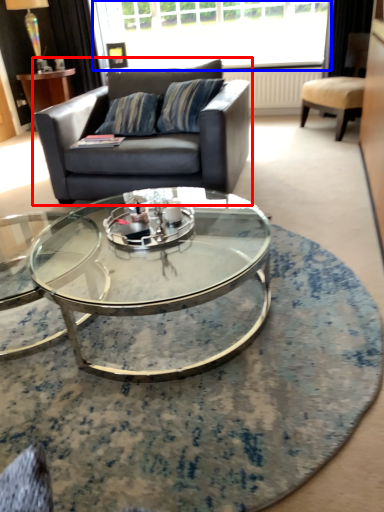
Question: Which of the following is the closest to the observer, studio couch (highlighted by a red box) or window (highlighted by a blue box)?

Choices:
 (A) studio couch
 (B) window

Answer: (A)